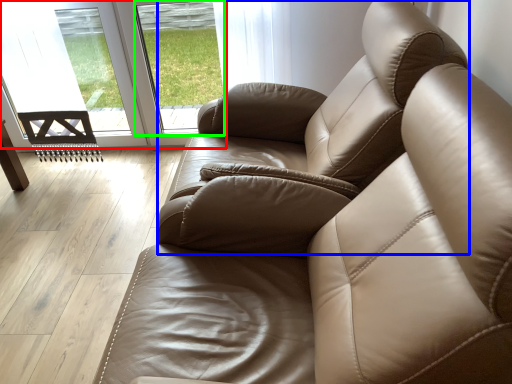
Question: Which object is the closest to the glass door (highlighted by a red box)? Choose among these: armchair (highlighted by a blue box) or window (highlighted by a green box).

Choices:
 (A) armchair
 (B) window

Answer: (B)